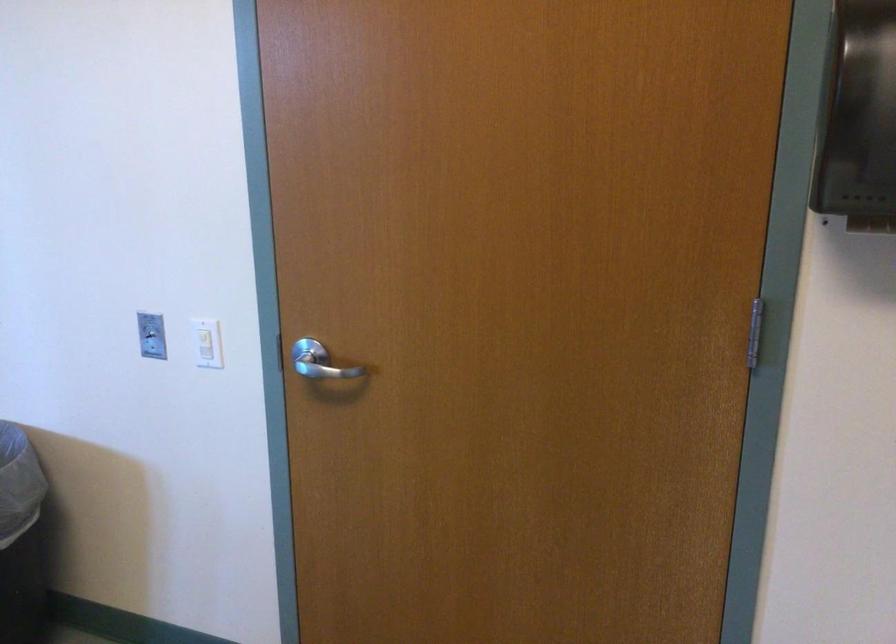
The height and width of the screenshot is (644, 896). What do you see at coordinates (319, 362) in the screenshot? I see `the silver door handle` at bounding box center [319, 362].